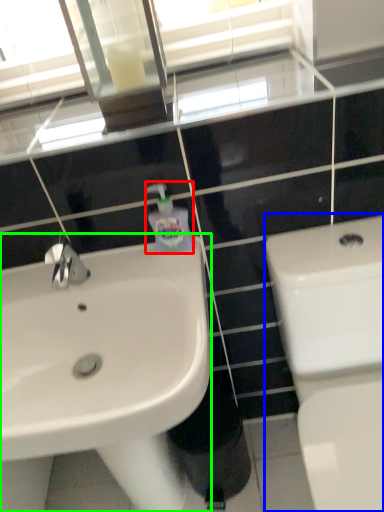
Question: Which object is the closest to the soap dispenser (highlighted by a red box)? Choose among these: toilet (highlighted by a blue box) or sink (highlighted by a green box).

Choices:
 (A) toilet
 (B) sink

Answer: (B)